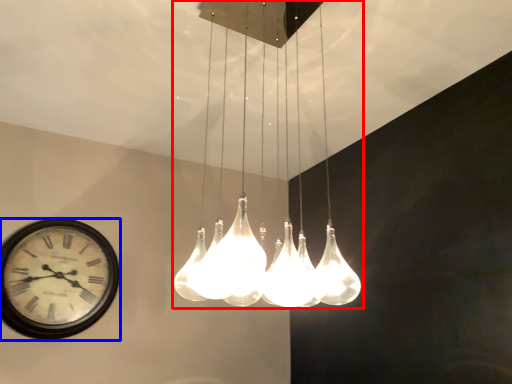
Question: Which object is closer to the camera taking this photo, lamp (highlighted by a red box) or wall clock (highlighted by a blue box)?

Choices:
 (A) lamp
 (B) wall clock

Answer: (A)